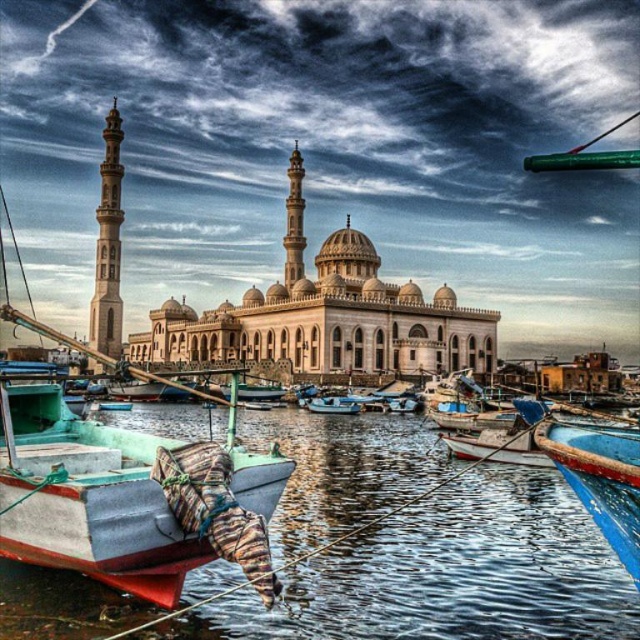
Who is positioned more to the left, beige stone mosque at center or blue polished wood boat at lower right?

beige stone mosque at center is more to the left.

Does beige stone mosque at center appear on the left side of blue polished wood boat at lower right?

Indeed, beige stone mosque at center is positioned on the left side of blue polished wood boat at lower right.

Measure the distance between point (356, 365) and camera.

A distance of 107.48 meters exists between point (356, 365) and camera.

Find the location of a particular element. This screenshot has width=640, height=640. beige stone mosque at center is located at coordinates (324, 316).

Can you confirm if beige stone mosque at center is positioned to the right of blue plastic boat at center?

In fact, beige stone mosque at center is to the left of blue plastic boat at center.

Does beige stone mosque at center have a smaller size compared to blue plastic boat at center?

Actually, beige stone mosque at center might be larger than blue plastic boat at center.

Where is `beige stone mosque at center`? The image size is (640, 640). beige stone mosque at center is located at coordinates (324, 316).

Where is `beige stone mosque at center`? beige stone mosque at center is located at coordinates (324, 316).

Between teal matte boat at center and beige stone mosque at center, which one appears on the left side from the viewer's perspective?

From the viewer's perspective, teal matte boat at center appears more on the left side.

Is point (72, 346) less distant than point (417, 346)?

Yes, point (72, 346) is in front of point (417, 346).

I want to click on teal matte boat at center, so click(124, 486).